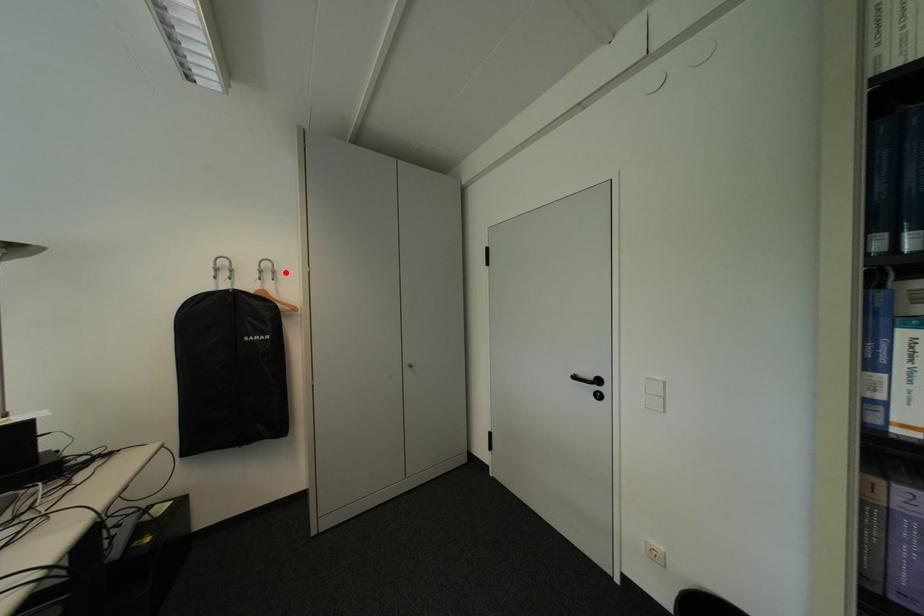
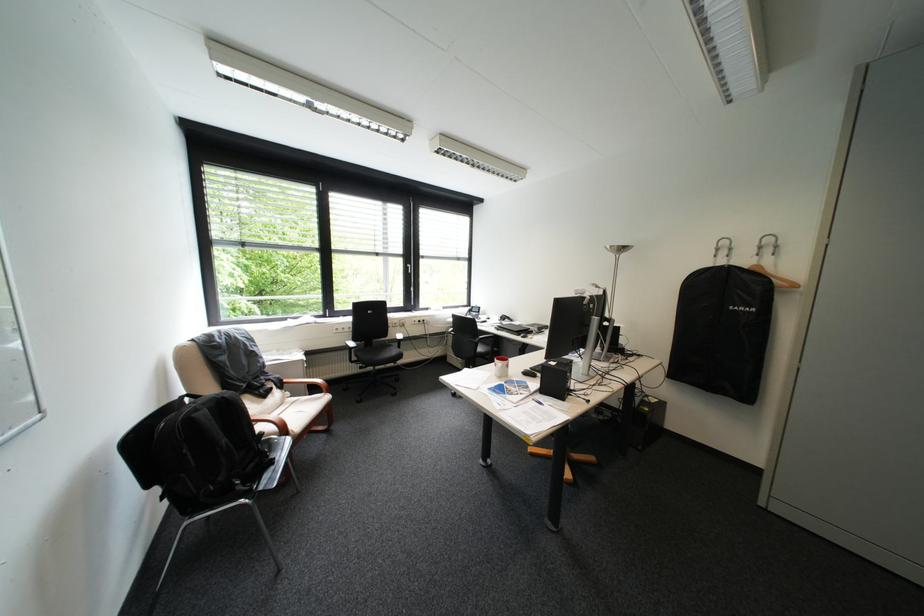
Where in the second image is the point corresponding to the highlighted location from the first image?

(788, 246)